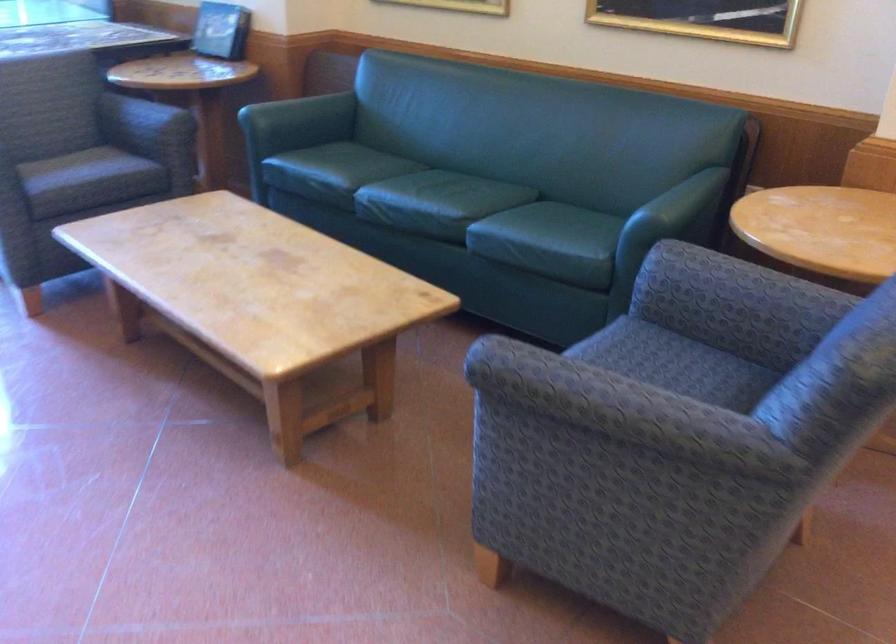
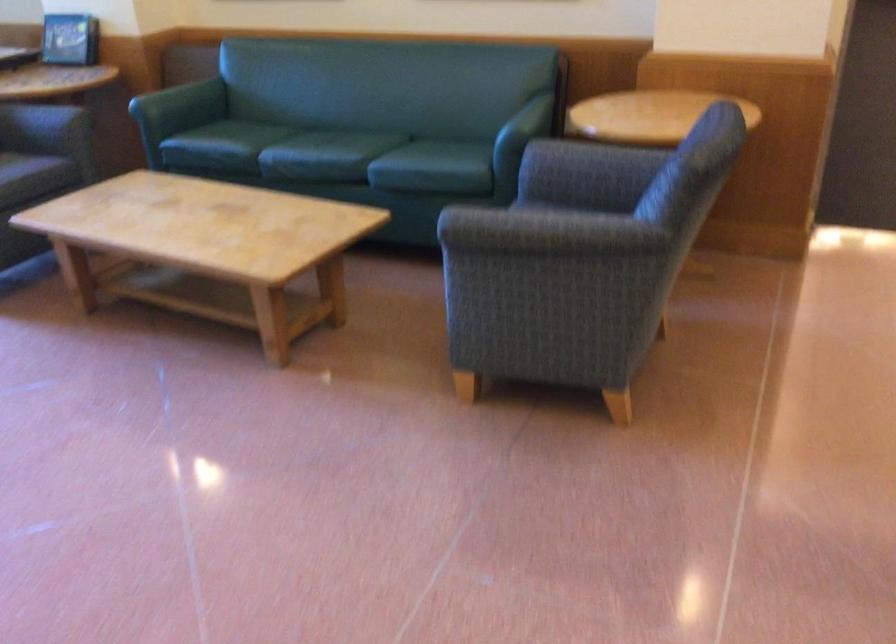
What movement of the cameraman would produce the second image?

The cameraman walked toward left, backward.